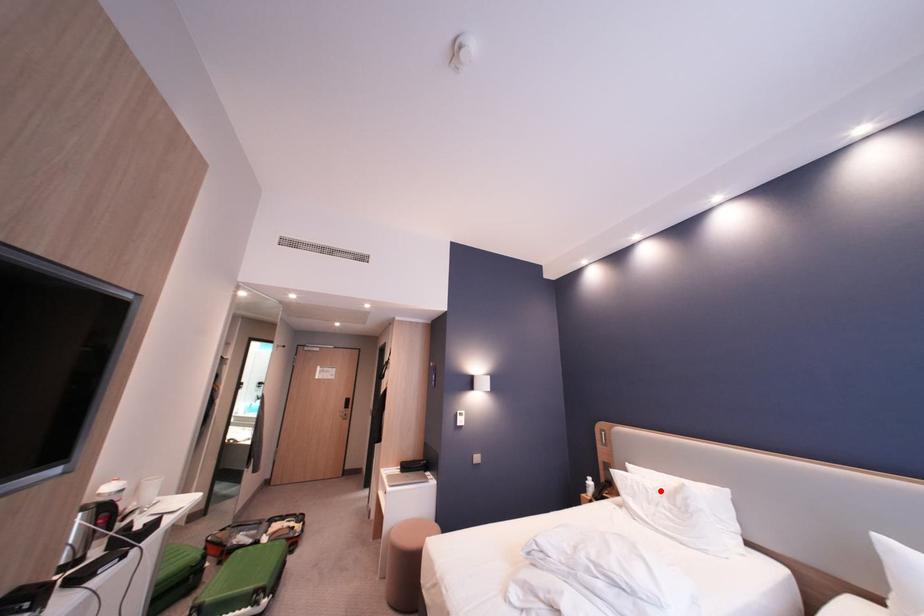
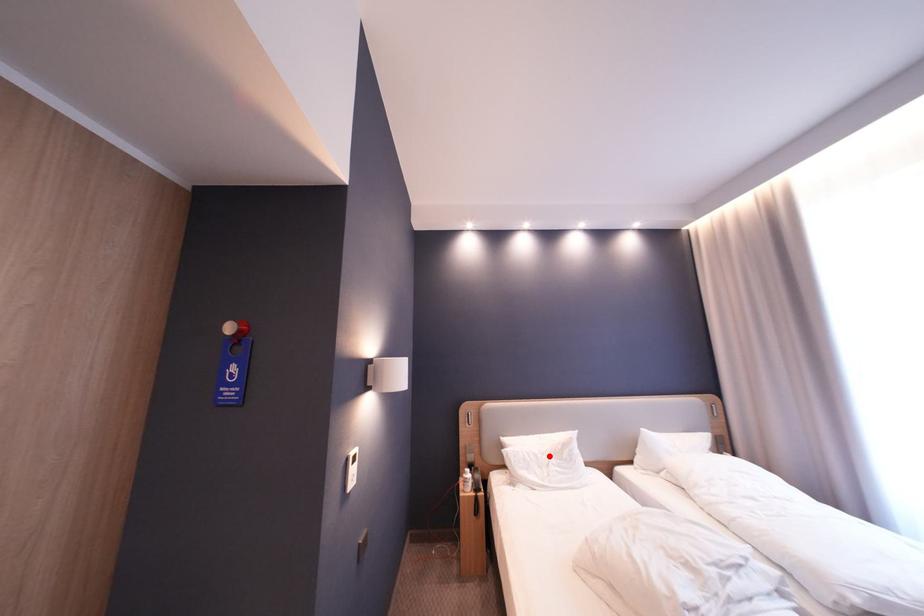
I am providing you with two images of the same scene from different viewpoints. A red point is marked on the first image and another point is marked on the second image. Do the highlighted points in image1 and image2 indicate the same real-world spot?

Yes